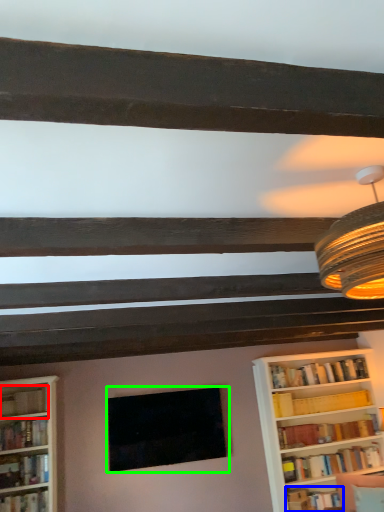
Question: Which object is positioned farthest from book (highlighted by a red box)? Select from book (highlighted by a blue box) and picture frame (highlighted by a green box).

Choices:
 (A) book
 (B) picture frame

Answer: (A)